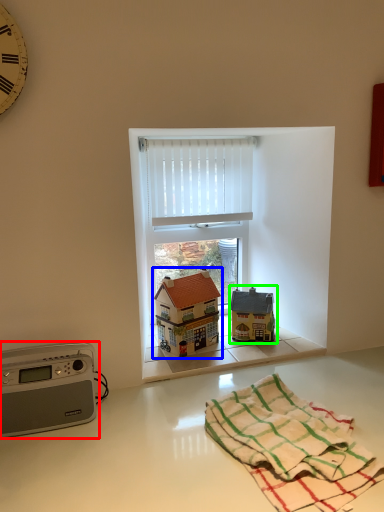
Question: Which object is the closest to the appliance (highlighted by a red box)? Choose among these: toy (highlighted by a blue box) or toy (highlighted by a green box).

Choices:
 (A) toy
 (B) toy

Answer: (A)